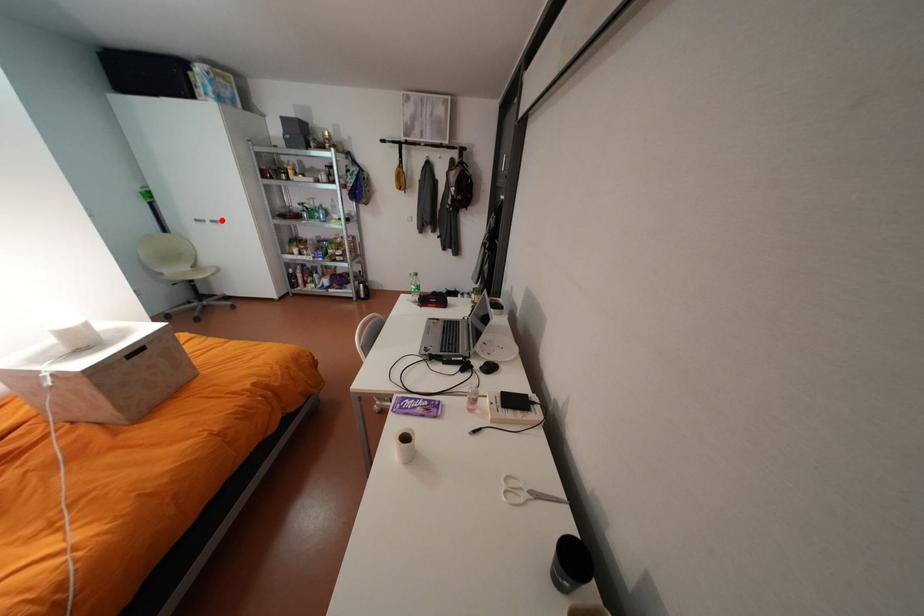
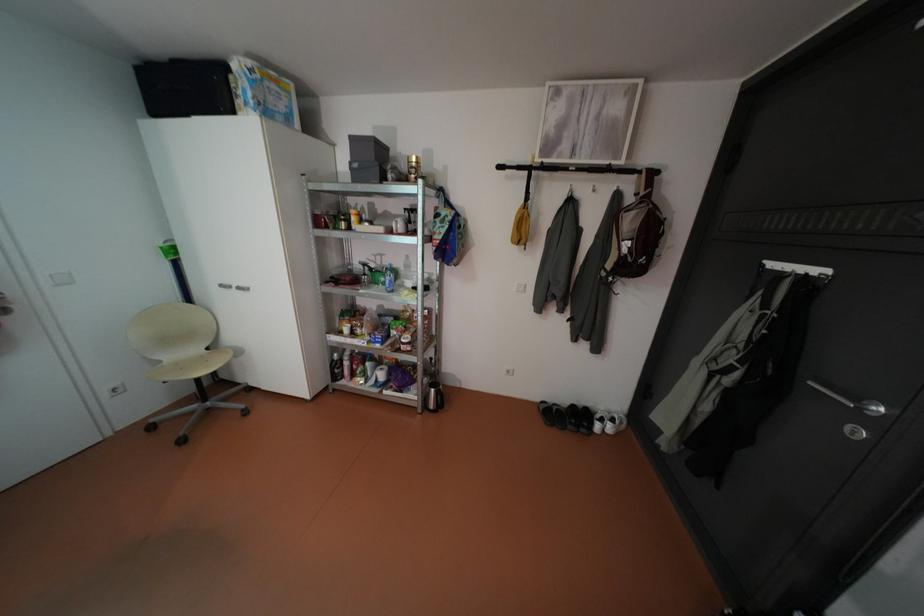
Where in the second image is the point corresponding to the highlighted location from the first image?

(248, 286)